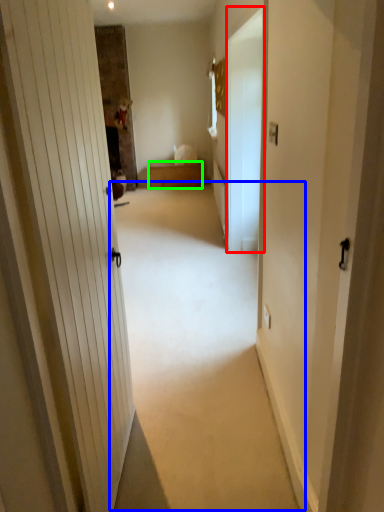
Question: Which object is the farthest from screen door (highlighted by a red box)? Choose among these: plain (highlighted by a blue box) or furniture (highlighted by a green box).

Choices:
 (A) plain
 (B) furniture

Answer: (B)